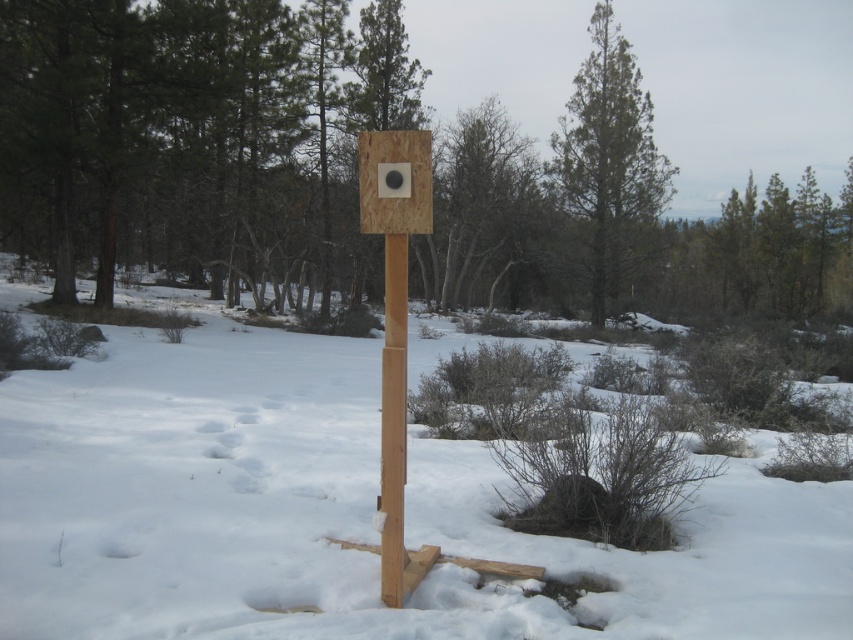
Is point (595, 52) closer to camera compared to point (399, 547)?

No, it is behind (399, 547).

Does green coniferous tree at upper center have a lesser width compared to light brown wood post at center?

In fact, green coniferous tree at upper center might be wider than light brown wood post at center.

Is point (637, 234) positioned after point (396, 595)?

That is True.

Identify the location of green coniferous tree at upper center. The height and width of the screenshot is (640, 853). (608, 157).

In the scene shown: Is white snow at center closer to camera compared to green coniferous tree at upper center?

That is True.

Does white snow at center have a lesser height compared to green coniferous tree at upper center?

Yes.

What do you see at coordinates (343, 512) in the screenshot? I see `white snow at center` at bounding box center [343, 512].

Image resolution: width=853 pixels, height=640 pixels. I want to click on white snow at center, so click(x=343, y=512).

Between point (616, 86) and point (416, 220), which one is positioned behind?

Positioned behind is point (616, 86).

Which is more to the left, green coniferous tree at upper center or matte wood sign at center?

Positioned to the left is matte wood sign at center.

Is point (585, 106) positioned after point (422, 204)?

Yes.

At what (x,y) coordinates should I click in order to perform the action: click on green coniferous tree at upper center. Please return your answer as a coordinate pair (x, y). This screenshot has height=640, width=853. Looking at the image, I should click on (608, 157).